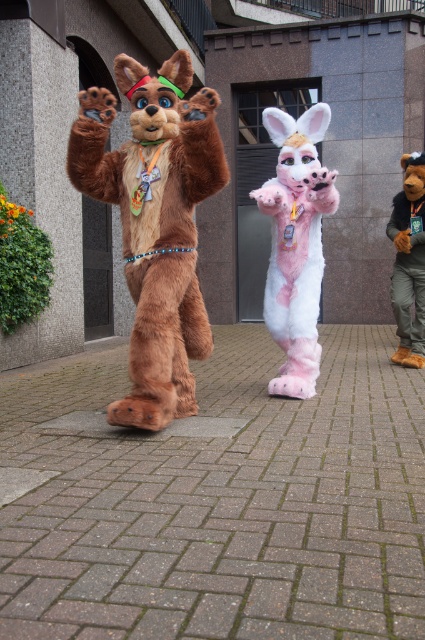
Based on the photo, you are standing in front of the bear and bunny characters at the event. You notice two points marked on the ground. The first point is at coordinate point (x=180, y=230) and the second is at point (x=302, y=230). Which point is closer to you?

Point (x=180, y=230) is closer to the viewer than point (x=302, y=230).

You are a photographer at the event and want to capture a photo where both the pink furry costume at center and the fuzzy brown bear at right are visible. Based on their positions, which costume is closer to the camera?

The pink furry costume at center is positioned under the fuzzy brown bear at right, meaning the fuzzy brown bear at right is closer to the camera since it is above the pink costume.